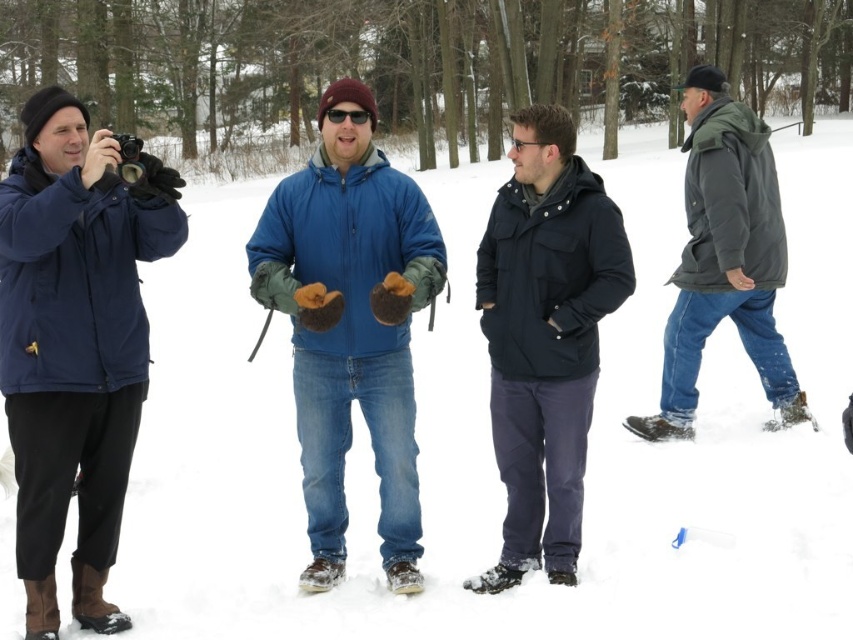
Question: Is navy blue jacket at left smaller than dark green puffy jacket at right?

Choices:
 (A) no
 (B) yes

Answer: (B)

Question: Which of these objects is positioned farthest from the dark blue matte jacket at center?

Choices:
 (A) blue fleece jacket at center
 (B) navy blue jacket at left
 (C) dark green puffy jacket at right

Answer: (C)

Question: Estimate the real-world distances between objects in this image. Which object is farther from the blue fleece jacket at center?

Choices:
 (A) dark green puffy jacket at right
 (B) navy blue jacket at left

Answer: (A)

Question: Does navy blue jacket at left come behind dark green puffy jacket at right?

Choices:
 (A) yes
 (B) no

Answer: (B)

Question: Among these objects, which one is nearest to the camera?

Choices:
 (A) dark green puffy jacket at right
 (B) blue fleece jacket at center
 (C) navy blue jacket at left

Answer: (C)

Question: Where is navy blue jacket at left located in relation to dark blue matte jacket at center in the image?

Choices:
 (A) right
 (B) left

Answer: (B)